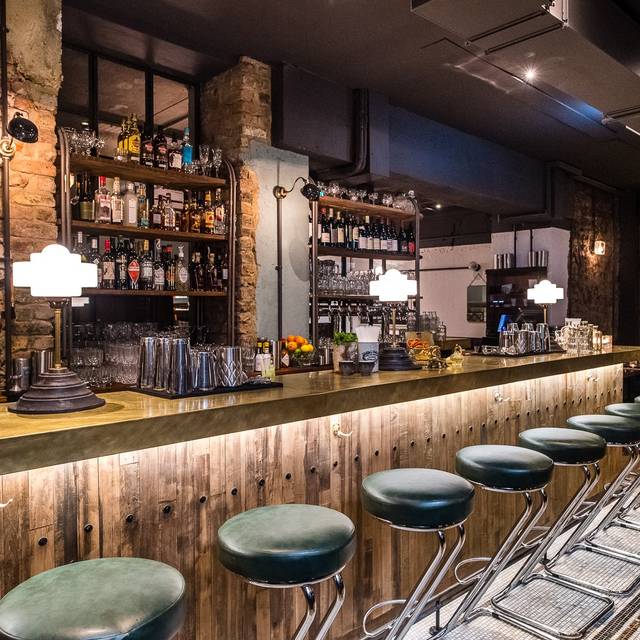
What are the coordinates of `purse hooks underneath the bar` in the screenshot? It's located at (4, 504), (338, 433), (500, 397), (593, 379).